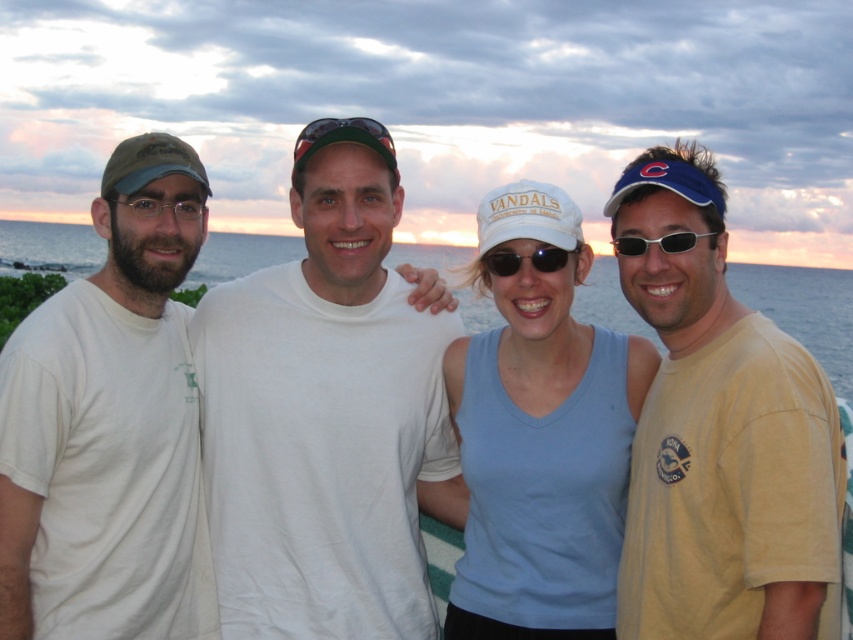
Question: Which point is farther to the camera?

Choices:
 (A) white cotton t-shirt at center
 (B) matte black glasses at left
 (C) white cotton t-shirt at left
 (D) light blue fabric tank top at center

Answer: (A)

Question: Considering the real-world distances, which object is closest to the white cotton t-shirt at center?

Choices:
 (A) yellow cotton t-shirt at right
 (B) white cotton t-shirt at left

Answer: (B)

Question: Is black plastic sunglasses at right above matte black glasses at left?

Choices:
 (A) yes
 (B) no

Answer: (B)

Question: Which object is farther from the camera taking this photo?

Choices:
 (A) white matte baseball cap at center
 (B) white cotton t-shirt at left
 (C) black reflective sunglasses at center

Answer: (C)

Question: Is yellow cotton t-shirt at right smaller than sunglasses at center?

Choices:
 (A) yes
 (B) no

Answer: (A)

Question: Can you confirm if white matte baseball cap at center is positioned above black plastic sunglasses at right?

Choices:
 (A) yes
 (B) no

Answer: (A)